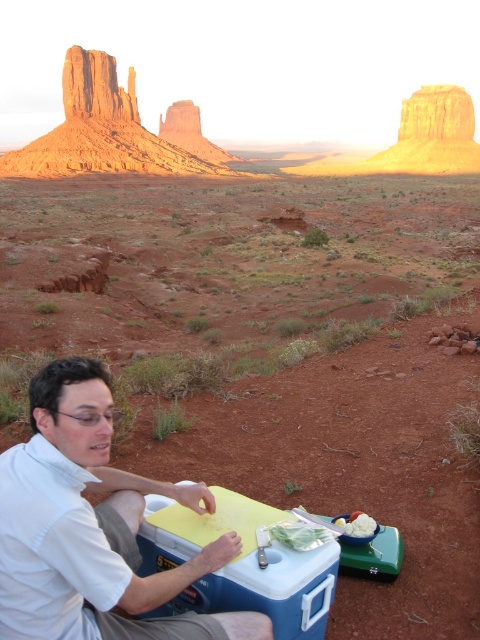
Who is taller, white matte shirt at lower left or blue plastic cooler at lower center?

white matte shirt at lower left is taller.

Find the location of a particular element. Image resolution: width=480 pixels, height=640 pixels. white matte shirt at lower left is located at coordinates (92, 528).

Between point (316, 564) and point (351, 541), which one is positioned behind?

Point (351, 541)

Who is shorter, blue plastic cooler at lower center or white fluffy ice cream at lower center?

white fluffy ice cream at lower center is shorter.

Who is more forward, (169, 525) or (367, 529)?

Positioned in front is point (169, 525).

Locate an element on the screen. The width and height of the screenshot is (480, 640). blue plastic cooler at lower center is located at coordinates (240, 564).

Who is higher up, white matte shirt at lower left or white fluffy ice cream at lower center?

white matte shirt at lower left is above.

Between point (41, 461) and point (365, 531), which one is positioned behind?

The point (365, 531) is more distant.

Who is more distant from viewer, (12, 582) or (351, 538)?

Point (351, 538)

Where is `white matte shirt at lower left`? This screenshot has height=640, width=480. white matte shirt at lower left is located at coordinates (92, 528).